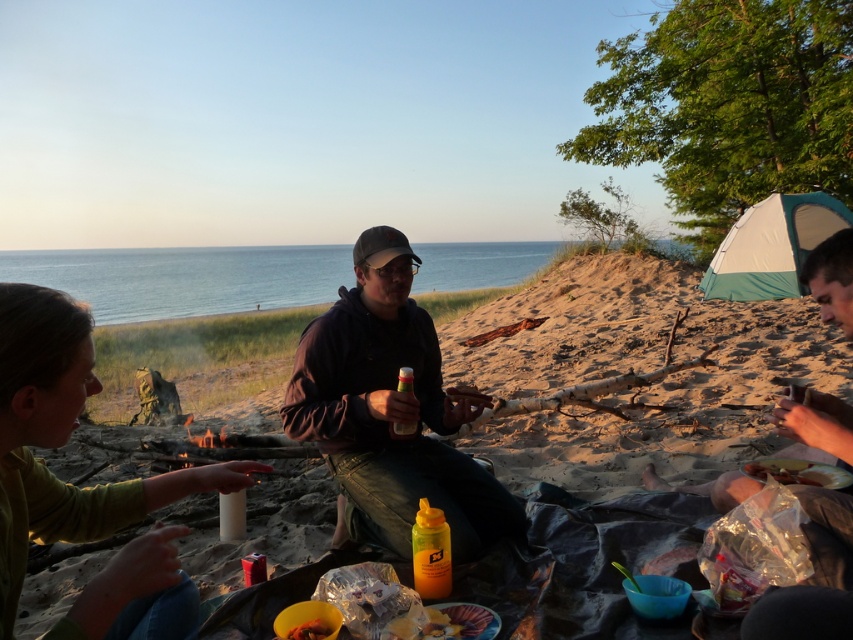
Is dark brown leather jacket at center smaller than translucent plastic cup at center?

Actually, dark brown leather jacket at center might be larger than translucent plastic cup at center.

Between dark brown leather jacket at center and translucent plastic cup at center, which one has more height?

With more height is dark brown leather jacket at center.

Identify the location of dark brown leather jacket at center. (390, 412).

You are a GUI agent. You are given a task and a screenshot of the screen. Output one action in this format:
    pyautogui.click(x=<x>, y=<y>)
    Task: Click on the dark brown leather jacket at center
    The width and height of the screenshot is (853, 640).
    Given the screenshot: What is the action you would take?
    pyautogui.click(x=390, y=412)

In the scene shown: Does dark brown leather jacket at center have a greater width compared to green matte shirt at lower left?

Yes.

Image resolution: width=853 pixels, height=640 pixels. What do you see at coordinates (390, 412) in the screenshot?
I see `dark brown leather jacket at center` at bounding box center [390, 412].

You are a GUI agent. You are given a task and a screenshot of the screen. Output one action in this format:
    pyautogui.click(x=<x>, y=<y>)
    Task: Click on the dark brown leather jacket at center
    This screenshot has width=853, height=640.
    Given the screenshot: What is the action you would take?
    pyautogui.click(x=390, y=412)

What do you see at coordinates (62, 438) in the screenshot?
I see `green matte shirt at lower left` at bounding box center [62, 438].

Measure the distance from green matte shirt at lower left to shiny plastic bag at lower right.

green matte shirt at lower left and shiny plastic bag at lower right are 5.65 feet apart from each other.

Does point (189, 609) come closer to viewer compared to point (764, 461)?

Yes, it is in front of point (764, 461).

This screenshot has width=853, height=640. Find the location of `green matte shirt at lower left`. green matte shirt at lower left is located at coordinates (62, 438).